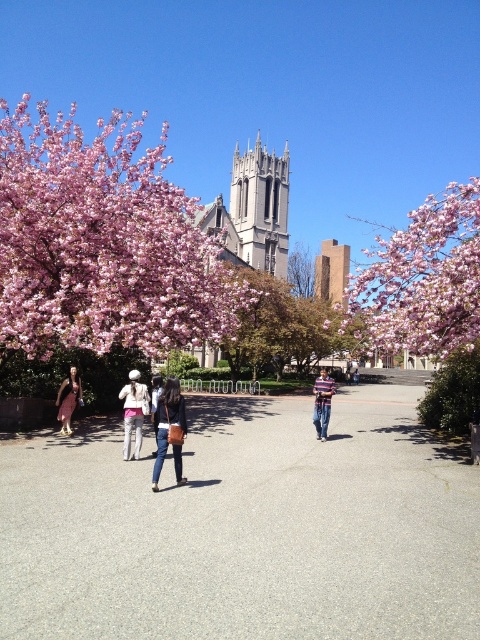
Consider the image. You are standing at the edge of the pathway and see the gray stone tower at center and the denim jeans at center. Which object is positioned to the right side of the other?

The gray stone tower at center is to the right of denim jeans at center.

You are a photographer trying to capture both the denim jeans at center and the matte brown dress at lower left in a single frame. Which of the two items should you focus on to ensure they are both clearly visible in your photo?

The denim jeans at center is bigger than the matte brown dress at lower left, so focusing on the denim jeans at center would help ensure both items are clearly visible since it takes up more space in the frame.